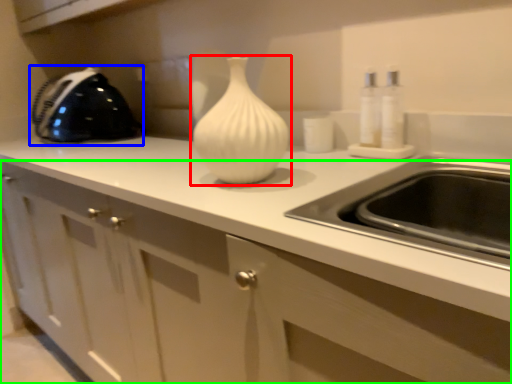
Question: Considering the real-world distances, which object is farthest from vase (highlighted by a red box)? appliance (highlighted by a blue box) or cabinetry (highlighted by a green box)?

Choices:
 (A) appliance
 (B) cabinetry

Answer: (A)